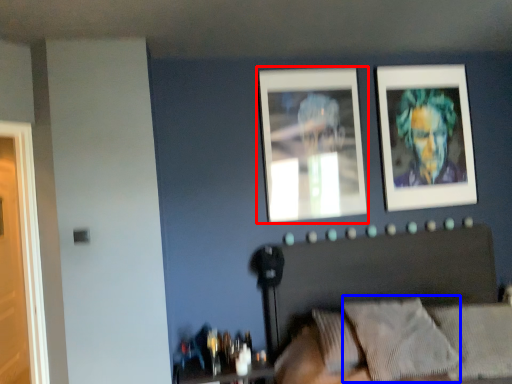
Question: Which of the following is the farthest to the observer, picture frame (highlighted by a red box) or pillow (highlighted by a blue box)?

Choices:
 (A) picture frame
 (B) pillow

Answer: (A)